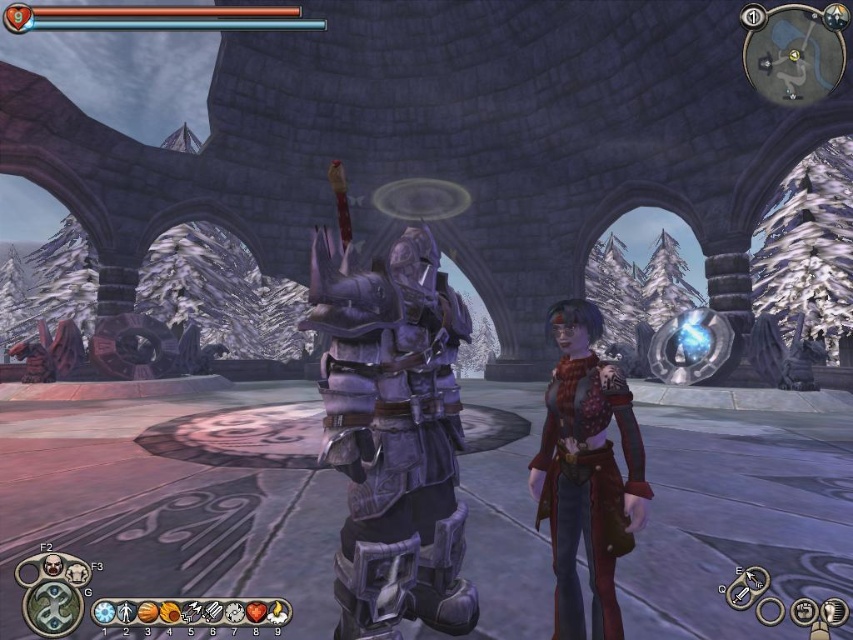
Looking at this image, is polished purple armor at center wider than red leather jacket at center?

Yes.

Does polished purple armor at center have a lesser height compared to red leather jacket at center?

No, polished purple armor at center is not shorter than red leather jacket at center.

Is point (444, 616) positioned before point (631, 522)?

No, (444, 616) is behind (631, 522).

At what (x,y) coordinates should I click in order to perform the action: click on polished purple armor at center. Please return your answer as a coordinate pair (x, y). Image resolution: width=853 pixels, height=640 pixels. Looking at the image, I should click on [x=393, y=436].